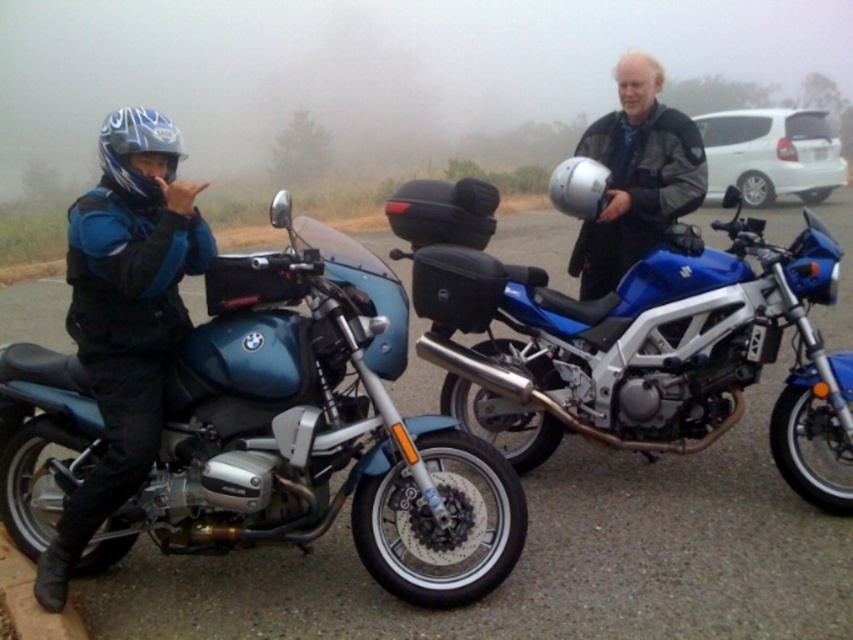
Question: Which point is closer to the camera?

Choices:
 (A) blue metallic motorcycle at center
 (B) metallic blue motorcycle at left
 (C) matte black helmet at center

Answer: (B)

Question: Among these points, which one is farthest from the camera?

Choices:
 (A) (672, 316)
 (B) (318, 442)
 (C) (631, 220)
 (D) (142, 172)

Answer: (C)

Question: Is metallic blue motorcycle at left above matte black helmet at center?

Choices:
 (A) no
 (B) yes

Answer: (A)

Question: In this image, where is blue metallic motorcycle at center located relative to matte blue motorcycle at left?

Choices:
 (A) above
 (B) below

Answer: (B)

Question: Which point is farther from the camera taking this photo?

Choices:
 (A) 593,225
 (B) 540,429
 (C) 288,524

Answer: (A)

Question: Can you confirm if metallic blue motorcycle at left is positioned above blue metallic motorcycle at center?

Choices:
 (A) no
 (B) yes

Answer: (A)